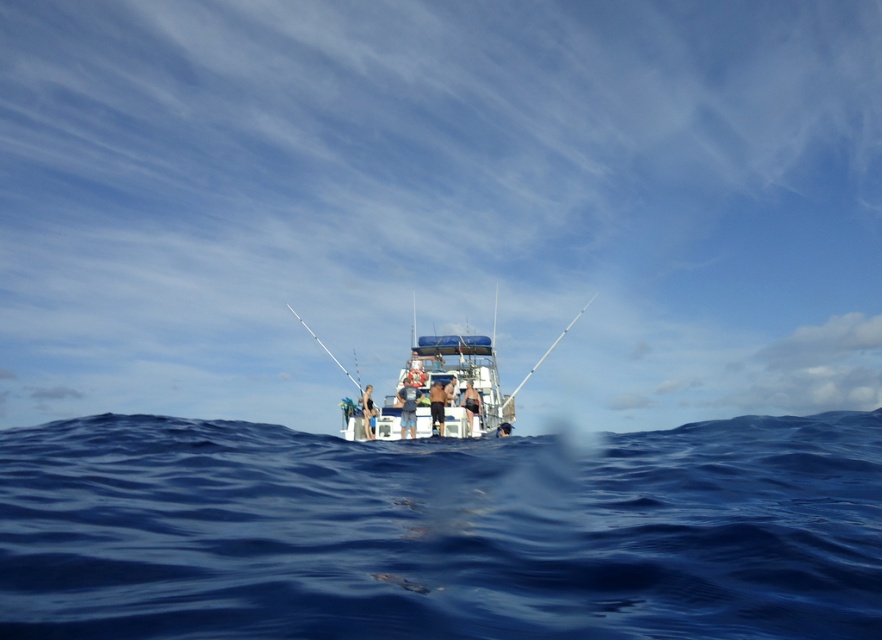
Question: Is deep blue water at center smaller than white fiberglass fishing pole at center?

Choices:
 (A) yes
 (B) no

Answer: (B)

Question: Is deep blue water at center bigger than white fiberglass fishing pole at center?

Choices:
 (A) no
 (B) yes

Answer: (B)

Question: Which object is closer to the camera taking this photo?

Choices:
 (A) white fiberglass fishing pole at center
 (B) deep blue water at center

Answer: (B)

Question: Can you confirm if deep blue water at center is smaller than white fiberglass fishing pole at center?

Choices:
 (A) yes
 (B) no

Answer: (B)